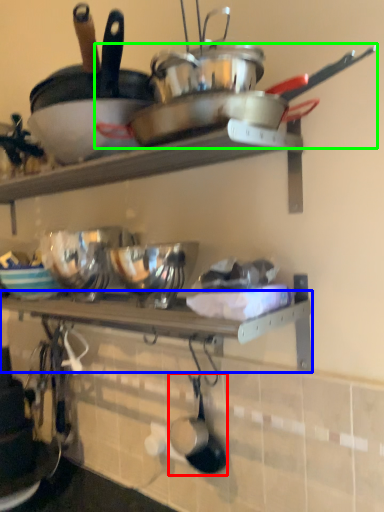
Question: Which object is the farthest from frying pan (highlighted by a red box)? Choose among these: shelf (highlighted by a blue box) or wok (highlighted by a green box).

Choices:
 (A) shelf
 (B) wok

Answer: (B)